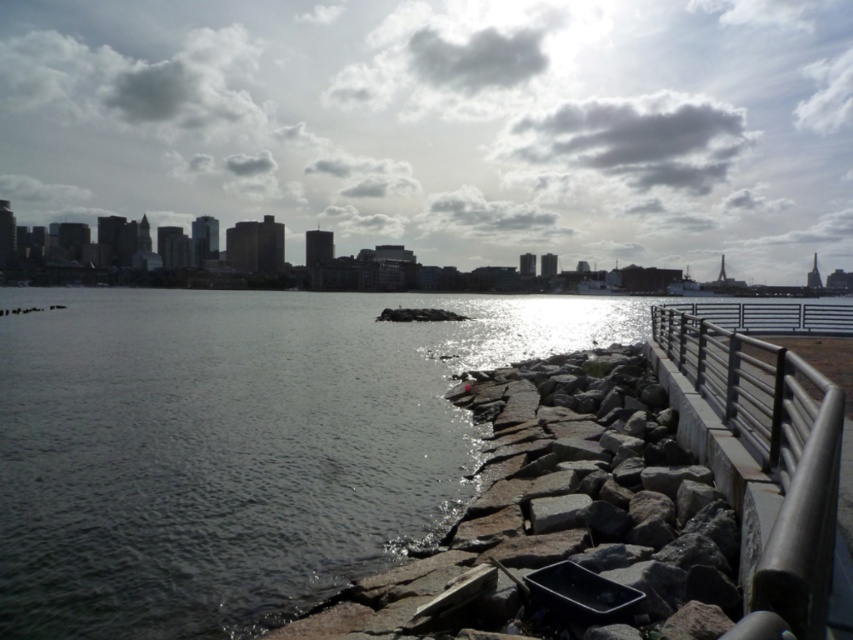
Question: Observing the image, what is the correct spatial positioning of dark gray water at center in reference to satin silver railing at right?

Choices:
 (A) left
 (B) right

Answer: (A)

Question: Among these objects, which one is farthest from the camera?

Choices:
 (A) dark gray water at center
 (B) satin silver railing at right

Answer: (A)

Question: Considering the relative positions of dark gray water at center and satin silver railing at right in the image provided, where is dark gray water at center located with respect to satin silver railing at right?

Choices:
 (A) right
 (B) left

Answer: (B)

Question: Can you confirm if dark gray water at center is thinner than satin silver railing at right?

Choices:
 (A) no
 (B) yes

Answer: (A)